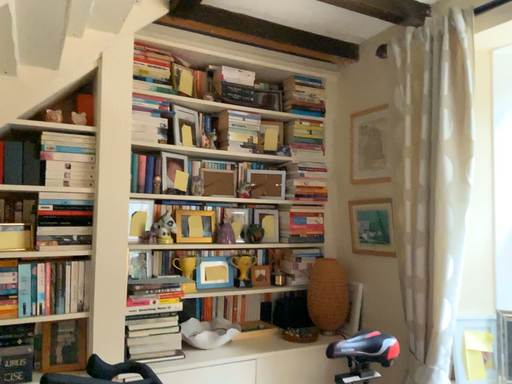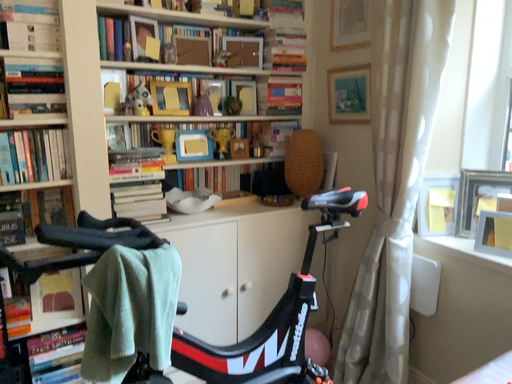
Question: Which way did the camera rotate in the video?

Choices:
 (A) rotated downward
 (B) rotated upward

Answer: (A)